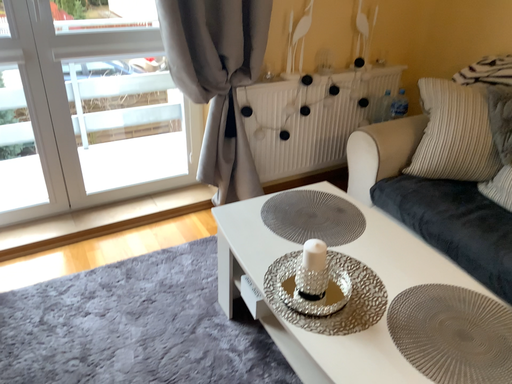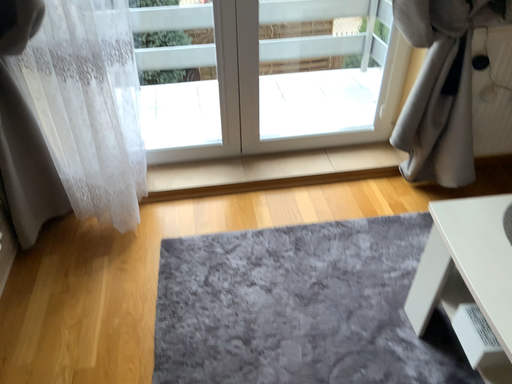
Question: How did the camera likely rotate when shooting the video?

Choices:
 (A) rotated left
 (B) rotated right

Answer: (A)